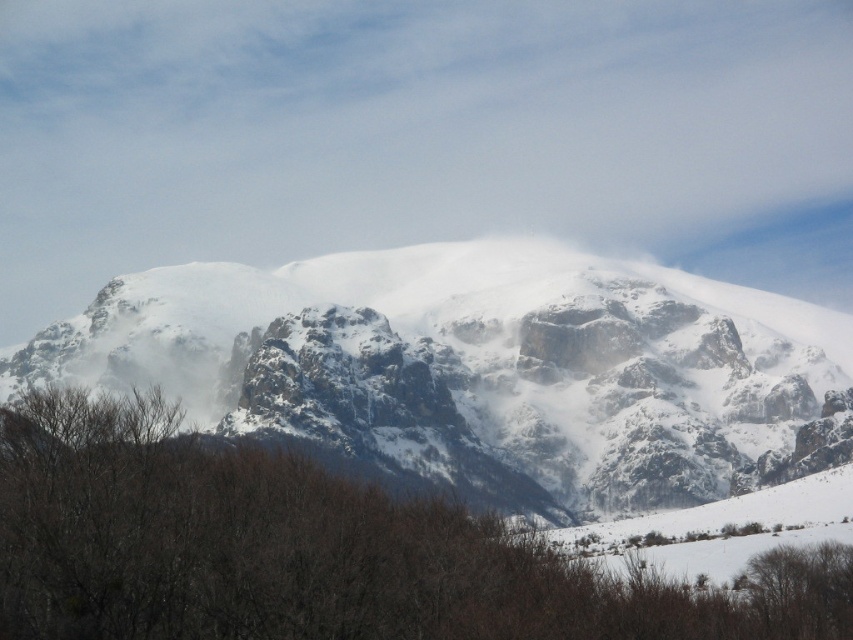
Is white snow-covered mountain at center smaller than brown matte tree at lower center?

No.

Is white snow-covered mountain at center closer to camera compared to brown matte tree at lower center?

No, white snow-covered mountain at center is behind brown matte tree at lower center.

Which is in front, point (489, 264) or point (54, 568)?

Point (54, 568)

Find the location of a particular element. The width and height of the screenshot is (853, 640). white snow-covered mountain at center is located at coordinates (480, 371).